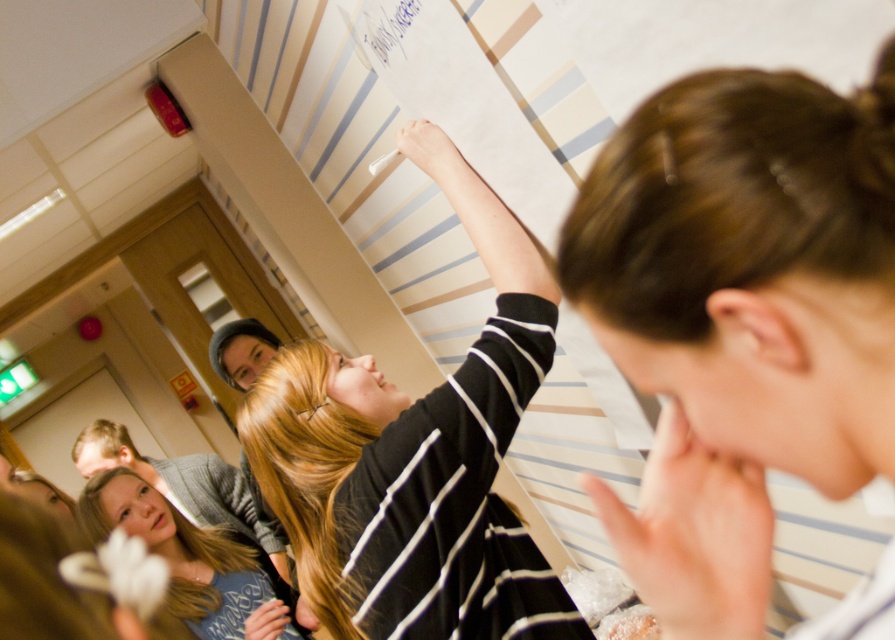
Question: Can you confirm if blonde hair at lower left is positioned above blue ink writing at upper center?

Choices:
 (A) yes
 (B) no

Answer: (B)

Question: Is blonde hair at lower left behind blue ink writing at upper center?

Choices:
 (A) yes
 (B) no

Answer: (A)

Question: Among these objects, which one is nearest to the camera?

Choices:
 (A) blue ink writing at upper center
 (B) brown hair at upper right
 (C) black striped sweater at upper center
 (D) blonde hair at lower left

Answer: (B)

Question: Can you confirm if brown hair at upper right is positioned to the left of blue ink writing at upper center?

Choices:
 (A) yes
 (B) no

Answer: (B)

Question: Which of the following is the closest to the observer?

Choices:
 (A) black striped sweater at upper center
 (B) blue ink writing at upper center
 (C) brown hair at upper right
 (D) blonde hair at lower left

Answer: (C)

Question: Which point is closer to the camera?

Choices:
 (A) blonde hair at lower left
 (B) black striped sweater at upper center

Answer: (B)